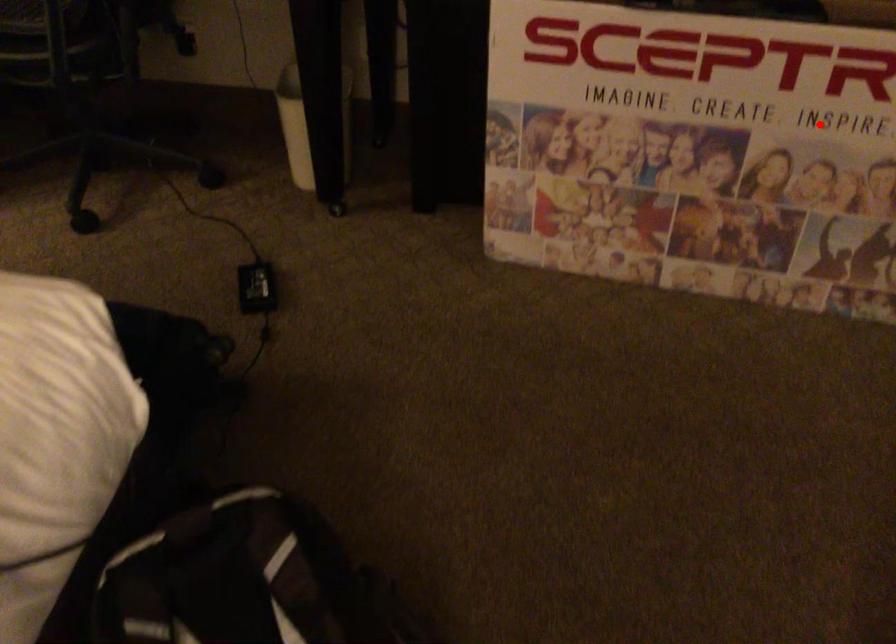
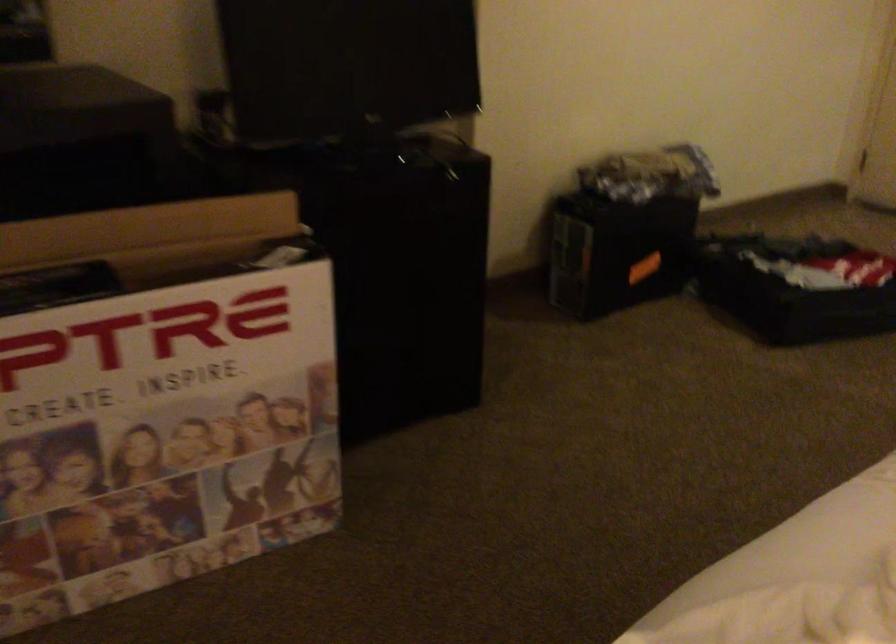
Where in the second image is the point corresponding to the highlighted location from the first image?

(171, 393)